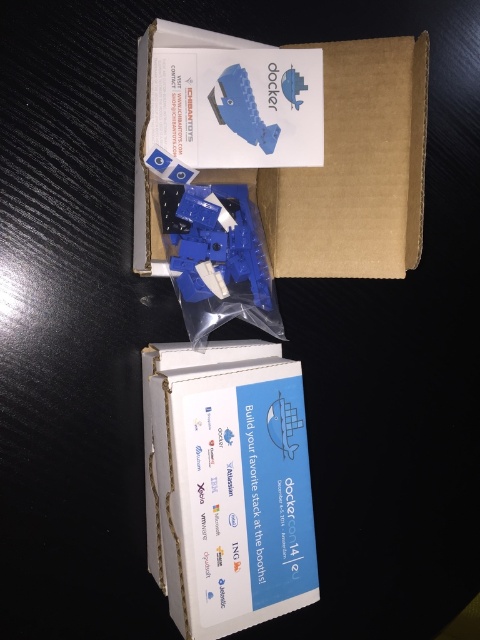
Question: Is white cardboard box at center below brown cardboard box at upper center?

Choices:
 (A) no
 (B) yes

Answer: (B)

Question: Does white cardboard box at center appear under blue plastic toy at upper center?

Choices:
 (A) yes
 (B) no

Answer: (A)

Question: Which of the following is the closest to the observer?

Choices:
 (A) white cardboard box at center
 (B) brown cardboard box at upper center

Answer: (A)

Question: Can you confirm if white cardboard box at center is positioned to the right of blue plastic toy at center?

Choices:
 (A) no
 (B) yes

Answer: (B)

Question: Which point is farther to the camera?

Choices:
 (A) white cardboard box at center
 (B) blue plastic toy at center

Answer: (B)

Question: Which object is positioned farthest from the brown cardboard box at upper center?

Choices:
 (A) white cardboard box at center
 (B) blue plastic toy at upper center

Answer: (A)